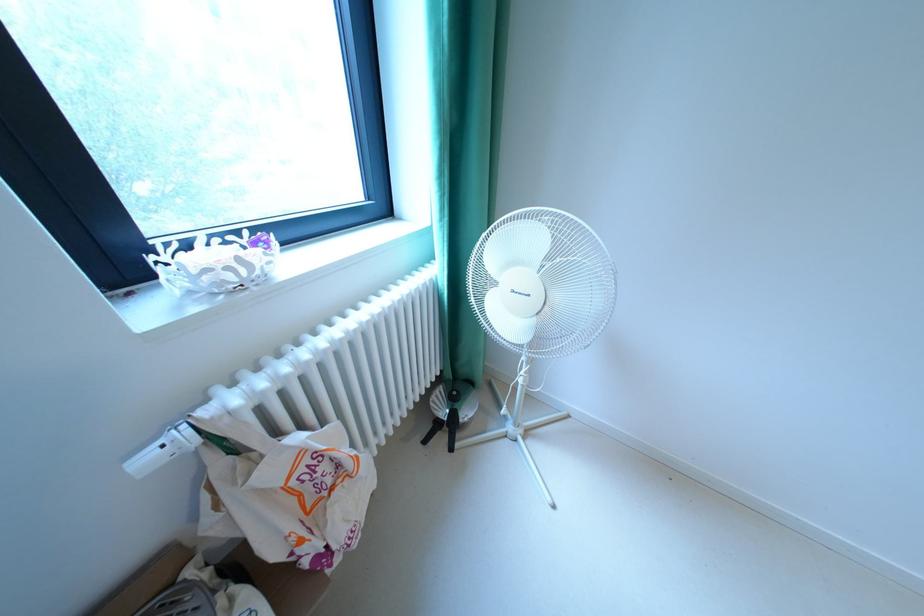
You are a GUI agent. You are given a task and a screenshot of the screen. Output one action in this format:
    pyautogui.click(x=<x>, y=<y>)
    Task: Click on the white decorative bowl
    Image resolution: width=924 pixels, height=616 pixels.
    Given the screenshot: What is the action you would take?
    pyautogui.click(x=215, y=262)